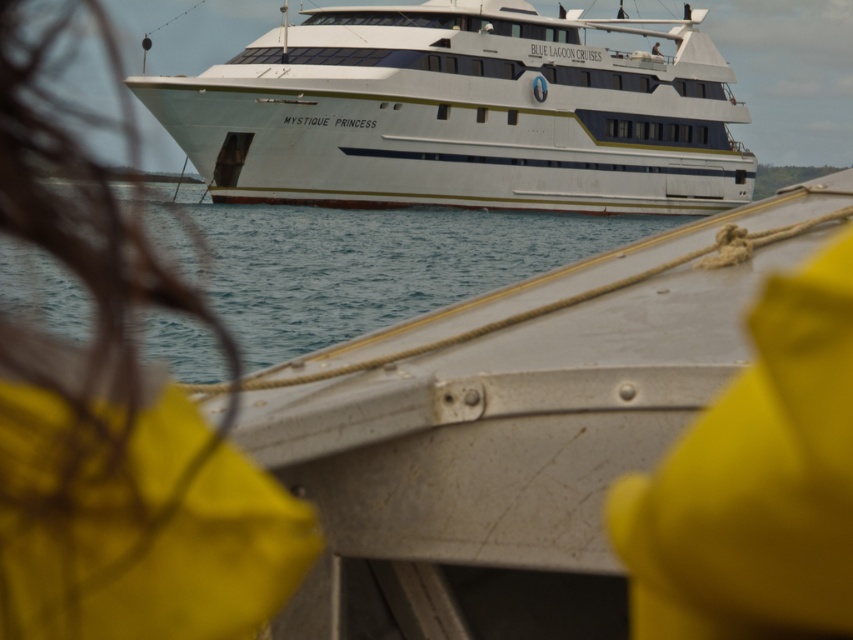
Can you confirm if white glossy ship at center is smaller than clear blue water at center?

No.

Is white glossy ship at center in front of clear blue water at center?

No, it is not.

The image size is (853, 640). Describe the element at coordinates (462, 113) in the screenshot. I see `white glossy ship at center` at that location.

Locate an element on the screen. The height and width of the screenshot is (640, 853). white glossy ship at center is located at coordinates (462, 113).

Between point (221, 492) and point (241, 51), which one is positioned in front?

Point (221, 492) is more forward.

Who is more distant from viewer, (20, 65) or (480, 147)?

Positioned behind is point (480, 147).

Does point (19, 518) lie in front of point (192, 80)?

Yes, point (19, 518) is in front of point (192, 80).

Identify the location of yellow fabric at center. (115, 422).

Does yellow fabric at center lie in front of clear blue water at center?

That is True.

What are the coordinates of `yellow fabric at center` in the screenshot? It's located at (115, 422).